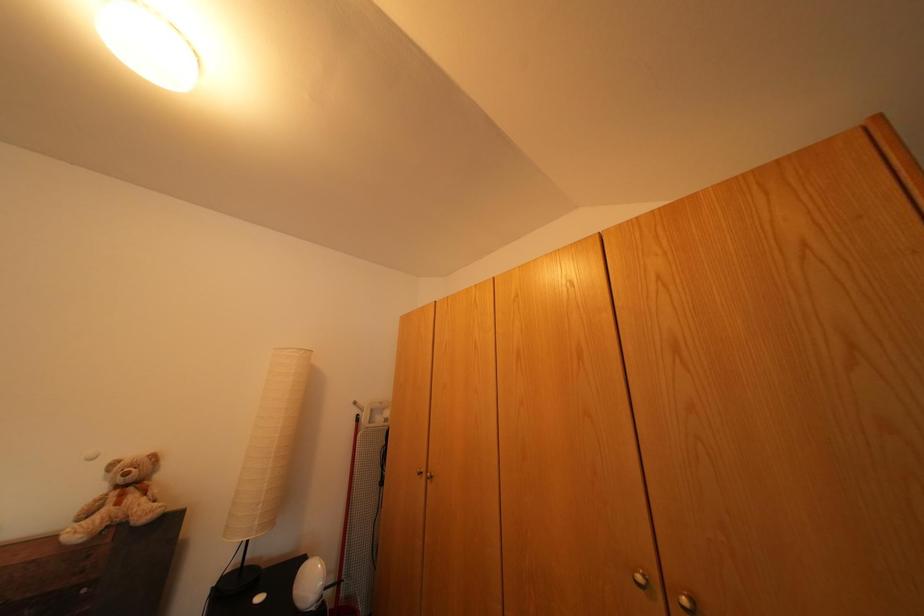
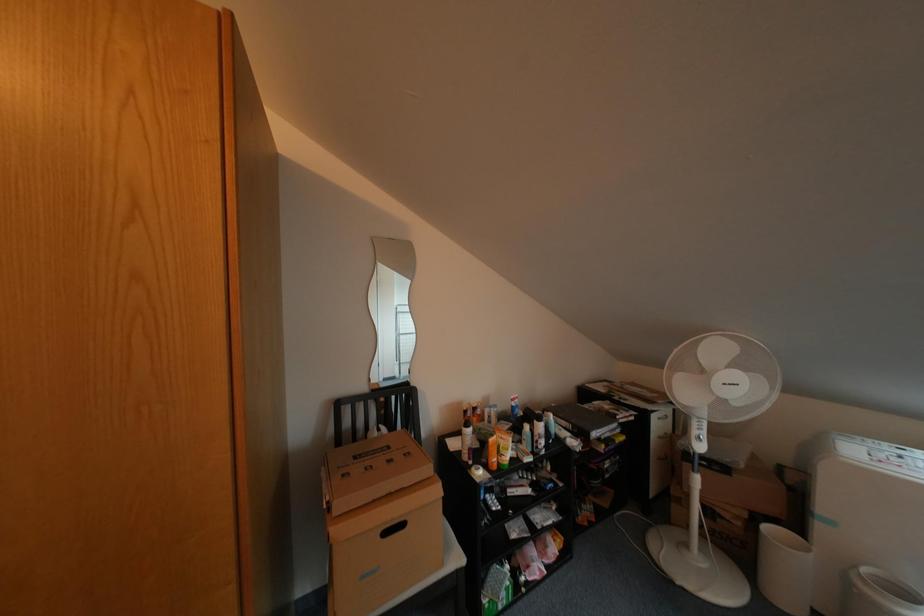
Question: Based on the continuous images, in which direction is the camera rotating? Reply with the corresponding letter.

Choices:
 (A) Left
 (B) Right
 (C) Up
 (D) Down

Answer: (B)